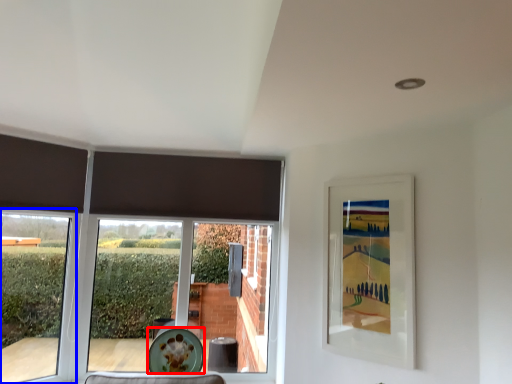
Question: Which object appears farthest to the camera in this image, plate (highlighted by a red box) or window (highlighted by a blue box)?

Choices:
 (A) plate
 (B) window

Answer: (A)